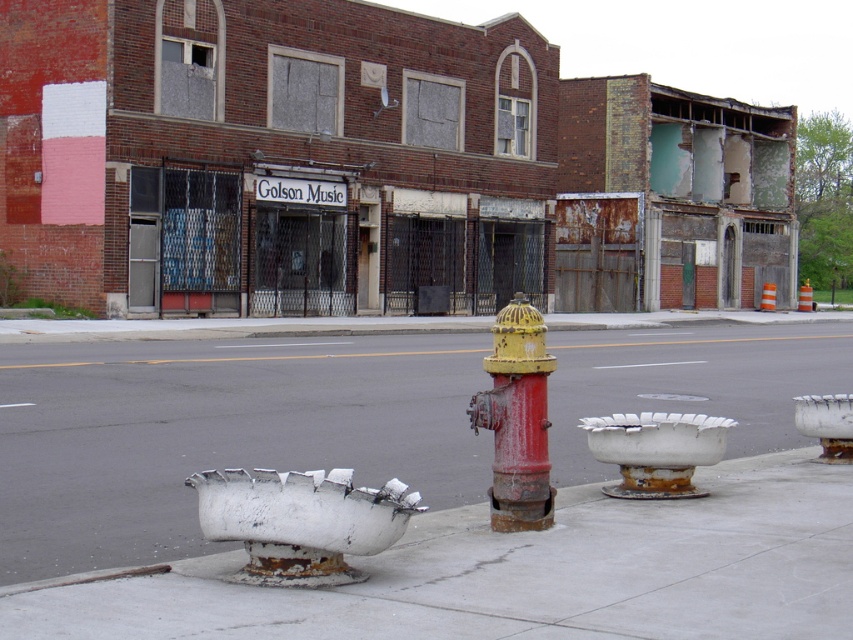
You are a city inspector evaluating the sidewalk in front of the dilapidated building. You notice the rusty metal fire hydrant at center and the white matte vent at center. Which object takes up more space on the sidewalk?

The rusty metal fire hydrant at center is bigger than the white matte vent at center, so it takes up more space on the sidewalk.

You are a city inspector assessing the sidewalk. You notice the rusty metal fire hydrant at center and the white matte vent at center. Which object is wider?

The rusty metal fire hydrant at center is wider than the white matte vent at center.

You are standing on the sidewalk in front of the dilapidated building and notice two points marked on the ground. The first point is at coordinates point (631,344) and the second is at point (527,509). Which point is closer to you?

Point (631,344) is closer to you because it is further to the viewer than point (527,509).